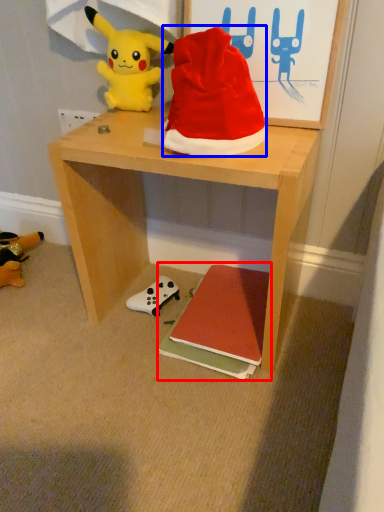
Question: Which object appears farthest to the camera in this image, book (highlighted by a red box) or hat (highlighted by a blue box)?

Choices:
 (A) book
 (B) hat

Answer: (A)